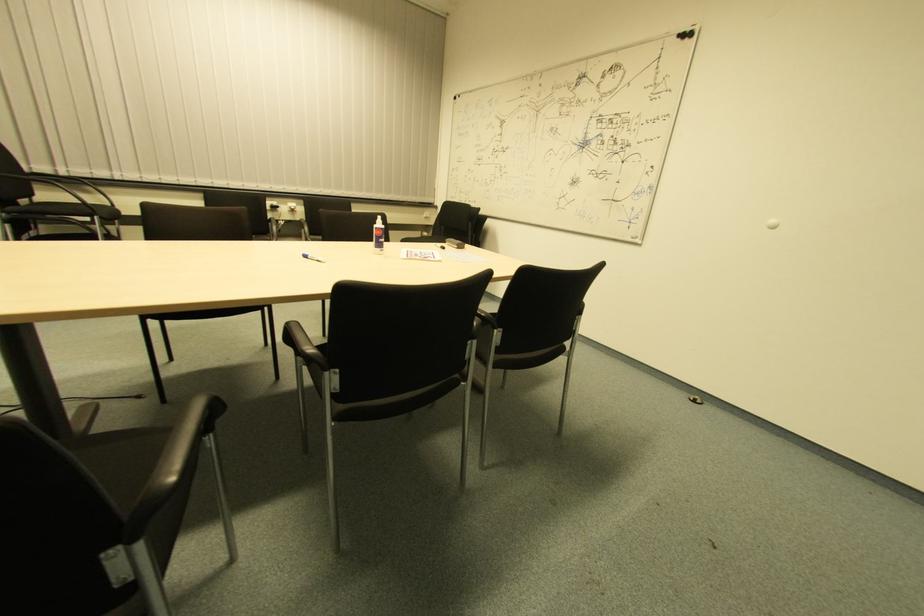
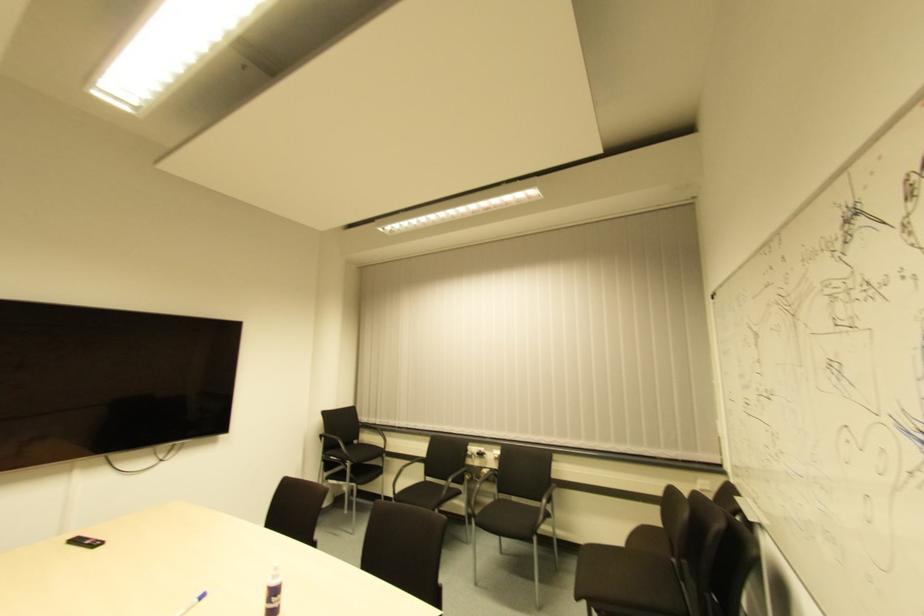
Find the pixel in the second image that matches [281,225] in the first image.

(483, 474)